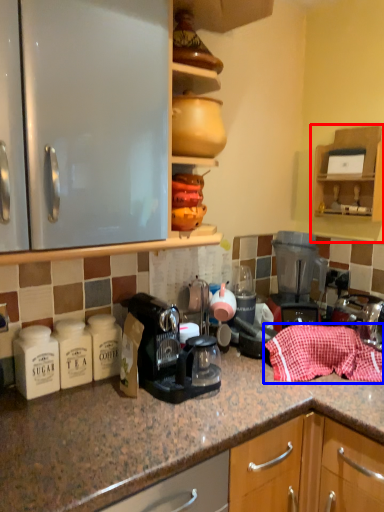
Question: Which object is closer to the camera taking this photo, cabinetry (highlighted by a red box) or material (highlighted by a blue box)?

Choices:
 (A) cabinetry
 (B) material

Answer: (B)